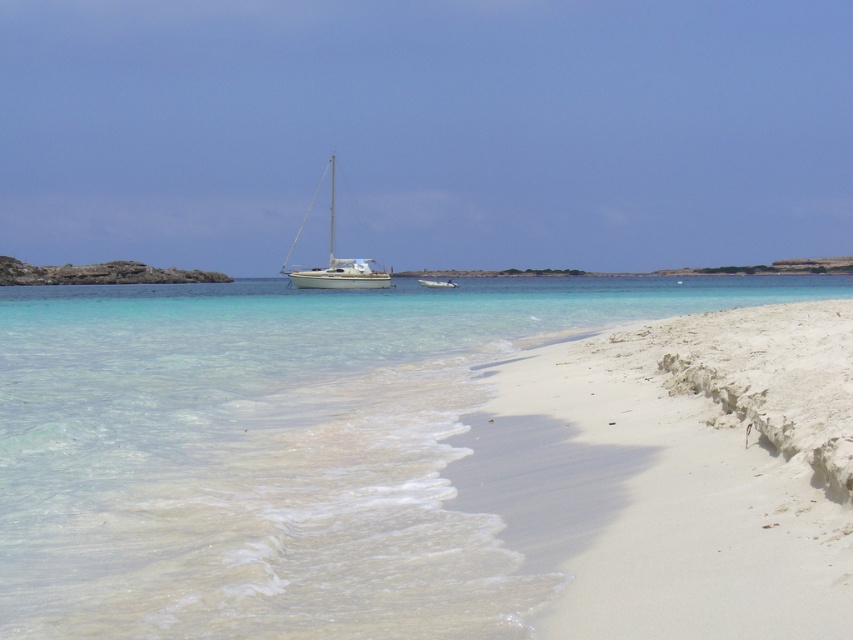
You are standing on the beach and want to take a photo of the white glossy sailboat at center. The clear water at center is in the way. Can you adjust your position so that the sailboat is fully visible without the water blocking it?

The clear water at center is closer to the viewer than the white glossy sailboat at center, so you can move to a higher position or angle your camera upwards to ensure the sailboat is fully visible beyond the water.

You are standing on the white sandy beach at lower right and want to reach the white glossy sailboat at center. Which direction should you walk to get closer to the sailboat?

You should walk towards the center of the image because the white glossy sailboat at center is positioned closer to the middle, while the white sandy beach at lower right is located at the lower right side of the frame.